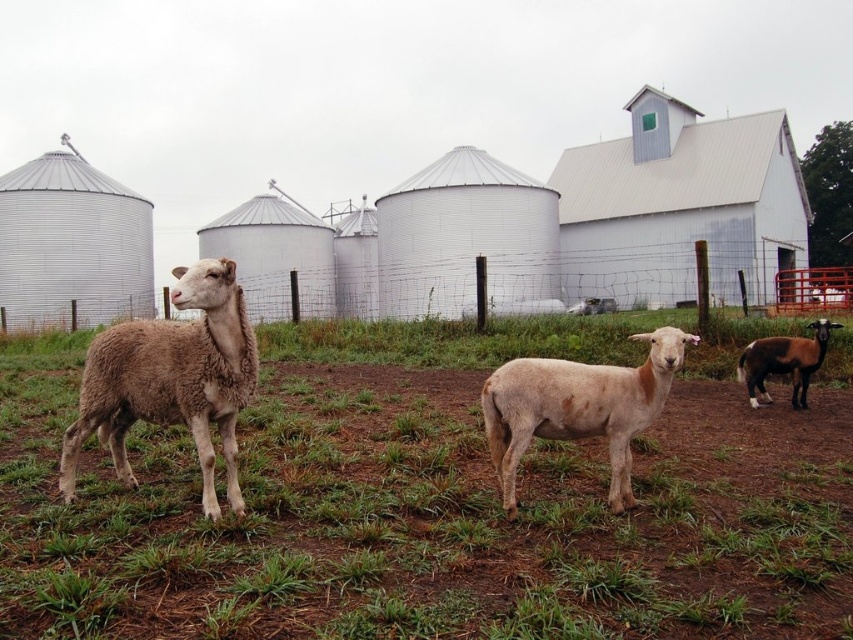
Question: Which point is closer to the camera?

Choices:
 (A) light brown woolly sheep at left
 (B) fuzzy white sheep at center
 (C) white metal barn at upper right

Answer: (A)

Question: Based on their relative distances, which object is farther from the brown glossy goat at right?

Choices:
 (A) white metal barn at upper right
 (B) fuzzy white sheep at center
 (C) green grass at center
 (D) light brown woolly sheep at left

Answer: (A)

Question: Is light brown woolly sheep at left thinner than brown glossy goat at right?

Choices:
 (A) yes
 (B) no

Answer: (B)

Question: Which of the following is the closest to the observer?

Choices:
 (A) (225, 413)
 (B) (825, 340)
 (C) (442, 528)

Answer: (C)

Question: Considering the relative positions of white metal barn at upper right and brown glossy goat at right in the image provided, where is white metal barn at upper right located with respect to brown glossy goat at right?

Choices:
 (A) above
 (B) below

Answer: (A)

Question: Is green grass at center above brown glossy goat at right?

Choices:
 (A) no
 (B) yes

Answer: (A)